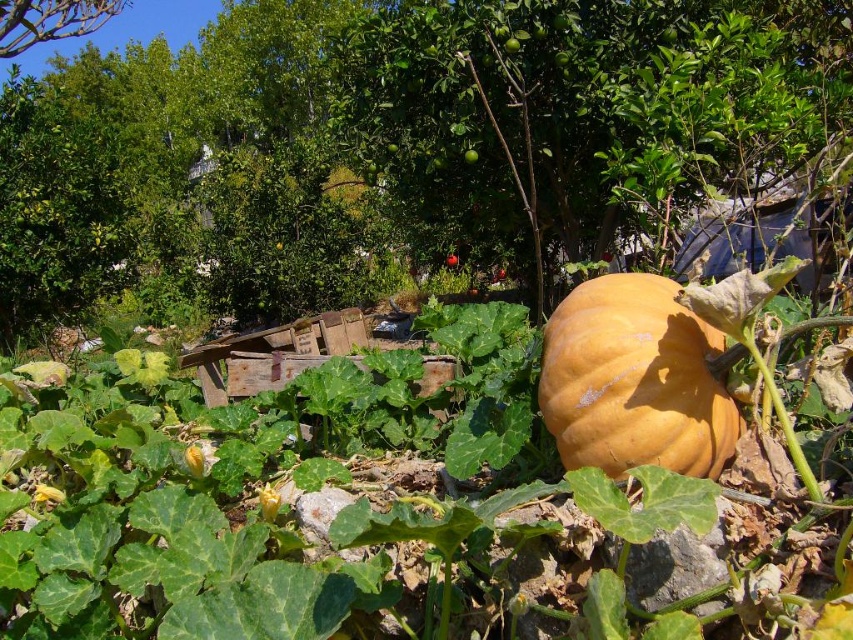
Question: Where is orange matte pumpkin at center located in relation to green leafy tree at upper left in the image?

Choices:
 (A) below
 (B) above

Answer: (A)

Question: Which of the following is the farthest from the observer?

Choices:
 (A) (16, 45)
 (B) (706, 332)

Answer: (A)

Question: From the image, what is the correct spatial relationship of orange matte pumpkin at center in relation to green leafy tree at upper left?

Choices:
 (A) above
 (B) below

Answer: (B)

Question: Which of the following is the closest to the observer?

Choices:
 (A) (717, 456)
 (B) (6, 29)

Answer: (A)

Question: Can you confirm if orange matte pumpkin at center is positioned below green leafy tree at upper left?

Choices:
 (A) yes
 (B) no

Answer: (A)